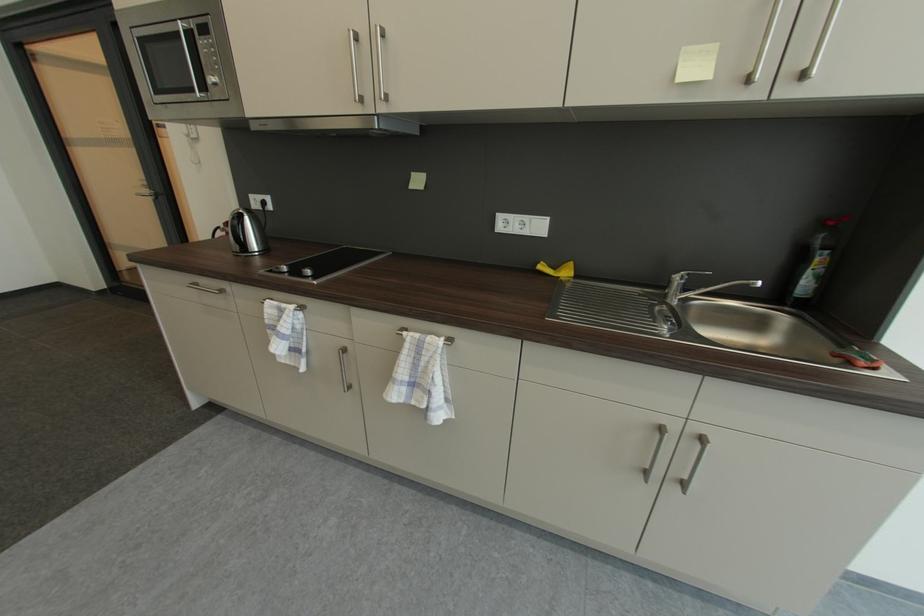
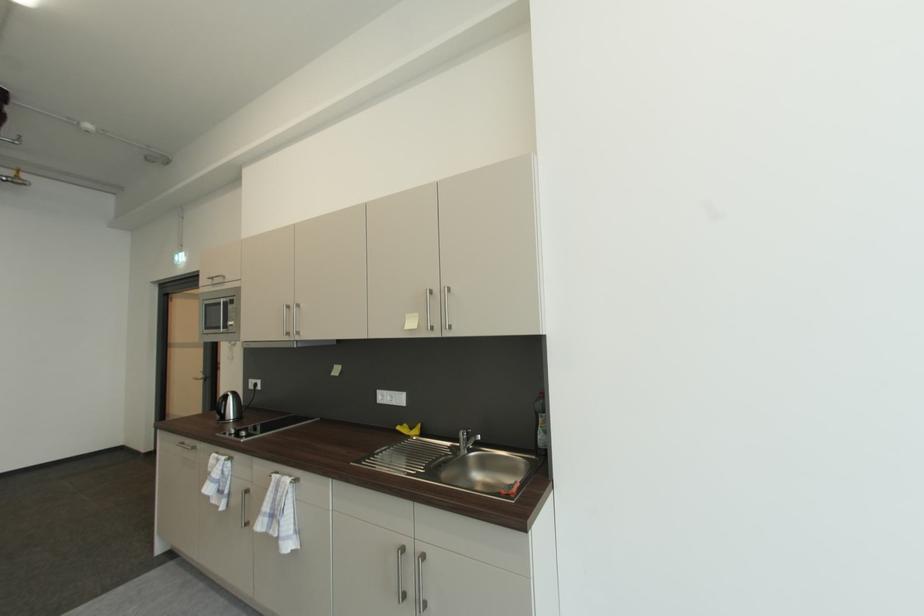
Where in the second image is the point corresponding to [407,337] from the first image?

(277, 477)